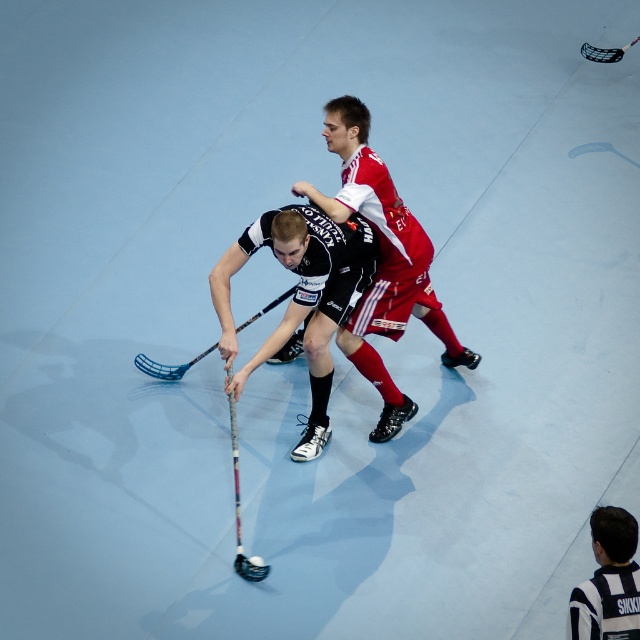
Question: Can you confirm if black and white striped shirt at lower right is positioned to the right of matte blue hockey stick at center?

Choices:
 (A) yes
 (B) no

Answer: (A)

Question: Among these objects, which one is nearest to the camera?

Choices:
 (A) matte blue hockey stick at center
 (B) black matte hockey stick at center
 (C) black and white striped shirt at lower right

Answer: (C)

Question: Which object appears closest to the camera in this image?

Choices:
 (A) black matte hockey stick at center
 (B) matte blue hockey stick at center
 (C) black and white striped shirt at lower right

Answer: (C)

Question: Is black matte hockey stick at center to the right of black and white striped shirt at lower right from the viewer's perspective?

Choices:
 (A) yes
 (B) no

Answer: (B)

Question: Which point is closer to the camera?

Choices:
 (A) (307, 276)
 (B) (596, 538)
 (C) (147, 362)

Answer: (B)

Question: Is black matte hockey stick at center smaller than black and white striped shirt at lower right?

Choices:
 (A) no
 (B) yes

Answer: (A)